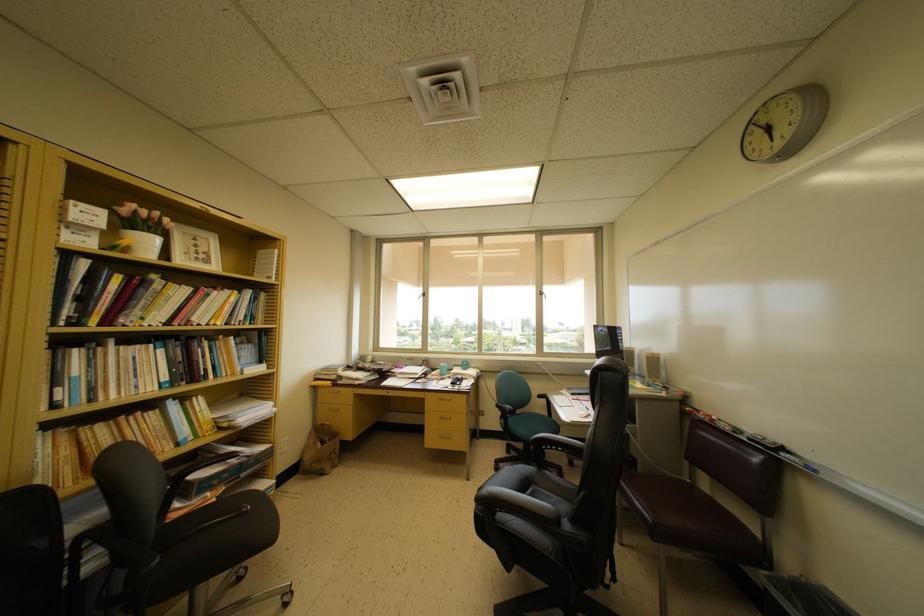
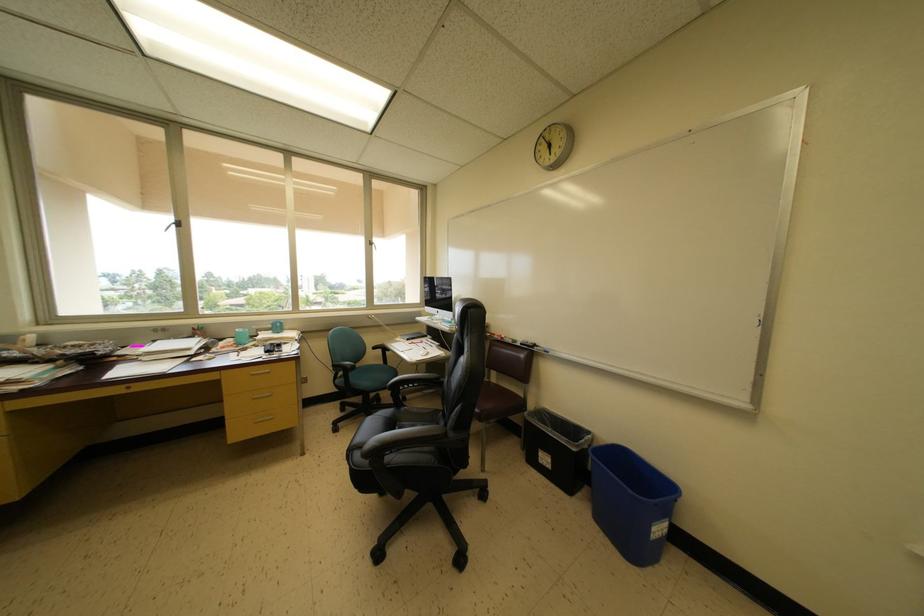
Question: The camera is either moving clockwise (left) or counter-clockwise (right) around the object. The first image is from the beginning of the video and the second image is from the end. Is the camera moving left or right when shooting the video?

Choices:
 (A) Left
 (B) Right

Answer: (A)